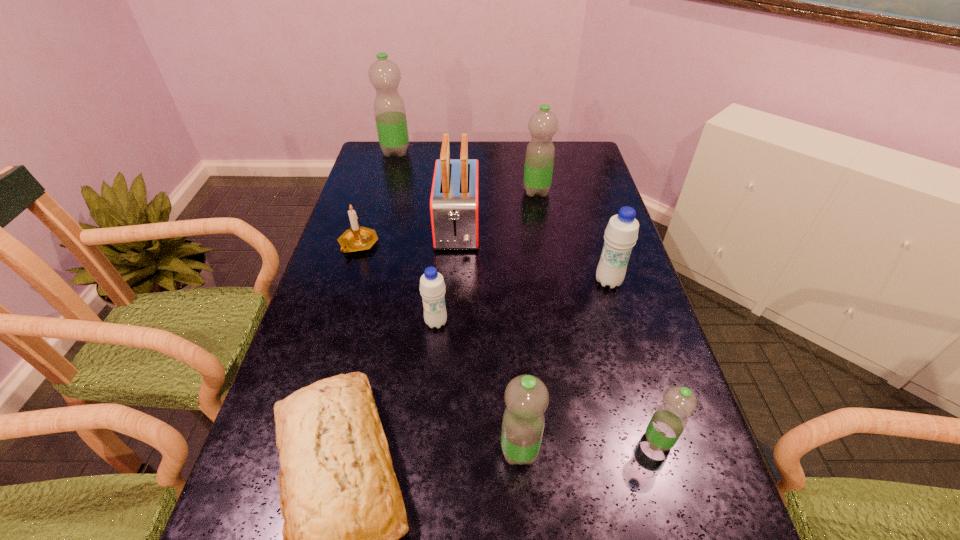
Image resolution: width=960 pixels, height=540 pixels. I want to click on empty space that is in between the third biggest green water bottle and the gold candle holder, so click(x=439, y=347).

Identify the location of free space between the red toaster and the sixth farthest object. This screenshot has width=960, height=540. (446, 275).

You are a GUI agent. You are given a task and a screenshot of the screen. Output one action in this format:
    pyautogui.click(x=<x>, y=<y>)
    Task: Click on the free space between the fourth nearest object and the farther blue water bottle
    This screenshot has width=960, height=540.
    Given the screenshot: What is the action you would take?
    pyautogui.click(x=522, y=302)

I want to click on free spot between the smallest green water bottle and the tallest object, so click(x=527, y=296).

I want to click on free space between the candle holder and the left blue water bottle, so [x=397, y=284].

Where is `free area in between the rightmost green water bottle and the fourth water bottle from left to right`? The height and width of the screenshot is (540, 960). free area in between the rightmost green water bottle and the fourth water bottle from left to right is located at coordinates (597, 316).

Locate which object is the fourth closest to the right blue water bottle. Please provide its 2D coordinates. Your answer should be formatted as a tuple, i.e. [(x, y)], where the tuple contains the x and y coordinates of a point satisfying the conditions above.

[(432, 287)]

Identify the location of object that is the fifth nearest to the fifth nearest object. (526, 397).

Find the location of `water bottle that is the sixth nearest to the bread`. water bottle that is the sixth nearest to the bread is located at coordinates (390, 115).

You are a GUI agent. You are given a task and a screenshot of the screen. Output one action in this format:
    pyautogui.click(x=<x>, y=<y>)
    Task: Click on the water bottle identified as the third closest to the third biggest green water bottle
    The height and width of the screenshot is (540, 960).
    Given the screenshot: What is the action you would take?
    pyautogui.click(x=621, y=233)